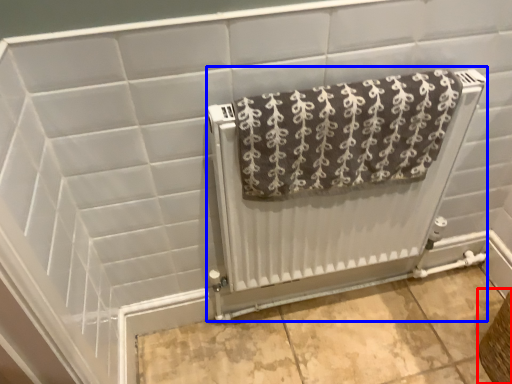
Question: Which object appears closest to the camera in this image, basket (highlighted by a red box) or radiator (highlighted by a blue box)?

Choices:
 (A) basket
 (B) radiator

Answer: (B)